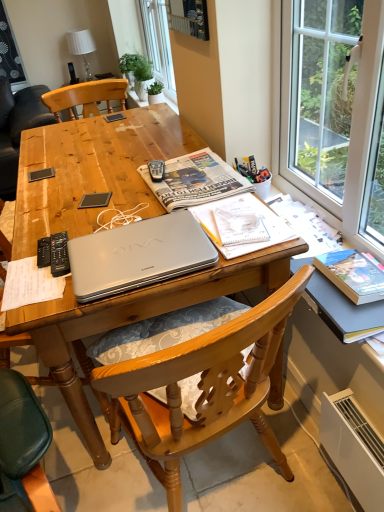
Where is `free space in front of black plastic remote control at left, which is counted as the second remote control, starting from the right`? The height and width of the screenshot is (512, 384). free space in front of black plastic remote control at left, which is counted as the second remote control, starting from the right is located at coordinates (34, 287).